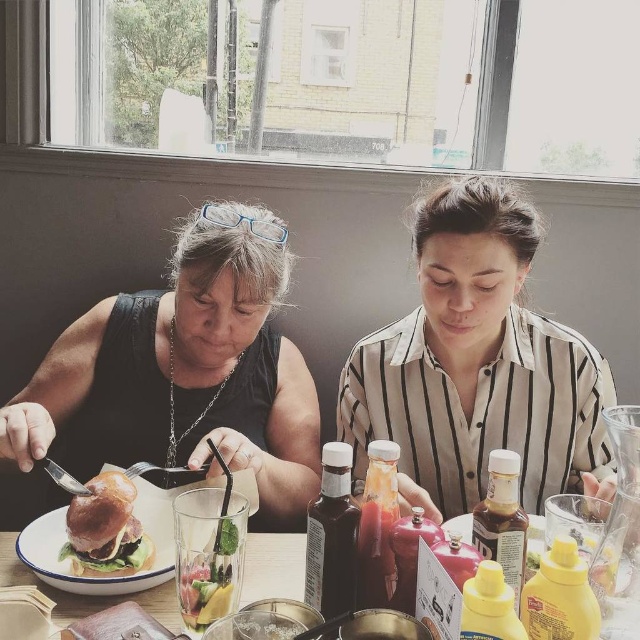
You are a waiter at the dining establishment. You need to place a new drink order for the customer seated at the wooden table at center. Where should you place the drink relative to the golden brown bun at center?

The wooden table at center is in front of the golden brown bun at center, so you should place the drink in front of the golden brown bun at center on the wooden table at center.

You are sitting at the table in the image and want to reach for the point at point (188, 432) and point (260, 582). Which point is closer to you?

Point (260, 582) is closer to you because point (188, 432) is behind it.